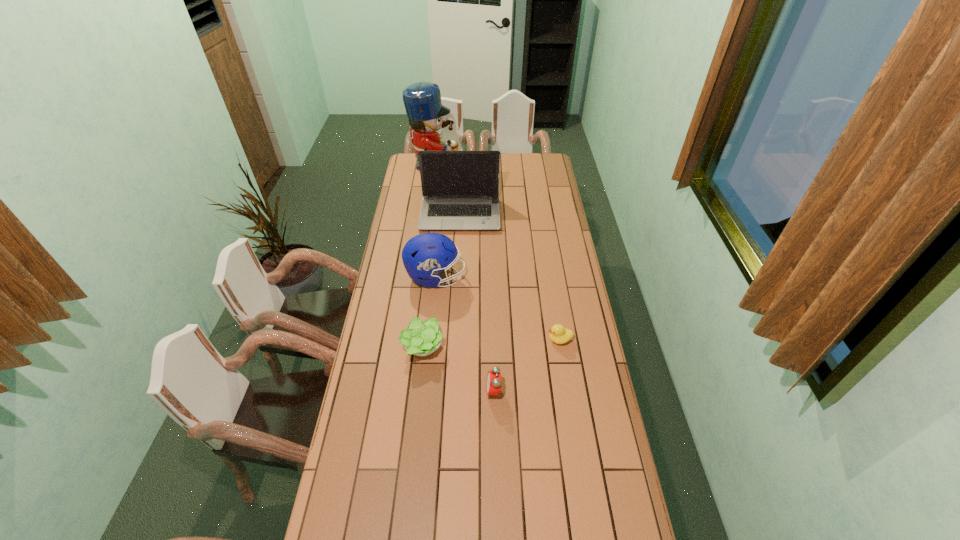
The height and width of the screenshot is (540, 960). I want to click on nutcracker, so coord(422,100).

Image resolution: width=960 pixels, height=540 pixels. Identify the location of the tallest object. (422, 100).

This screenshot has height=540, width=960. Find the location of `laptop computer`. laptop computer is located at coordinates (460, 189).

You are a GUI agent. You are given a task and a screenshot of the screen. Output one action in this format:
    pyautogui.click(x=<x>, y=<y>)
    Task: Click on the fifth nearest object
    This screenshot has width=960, height=540.
    Given the screenshot: What is the action you would take?
    pyautogui.click(x=460, y=189)

This screenshot has width=960, height=540. Find the location of `the fourth nearest object`. the fourth nearest object is located at coordinates (426, 255).

Where is `the third tallest object`? The image size is (960, 540). the third tallest object is located at coordinates (426, 255).

This screenshot has width=960, height=540. I want to click on the nearest object, so click(x=493, y=384).

The image size is (960, 540). What are the coordinates of `the third shortest object` in the screenshot? It's located at (493, 384).

At what (x,y) coordinates should I click in order to perform the action: click on lettuce. Please return your answer as a coordinate pair (x, y). This screenshot has height=540, width=960. Looking at the image, I should click on (420, 338).

You are a GUI agent. You are given a task and a screenshot of the screen. Output one action in this format:
    pyautogui.click(x=<x>, y=<y>)
    Task: Click on the rightmost object
    This screenshot has width=960, height=540.
    Given the screenshot: What is the action you would take?
    pyautogui.click(x=558, y=334)